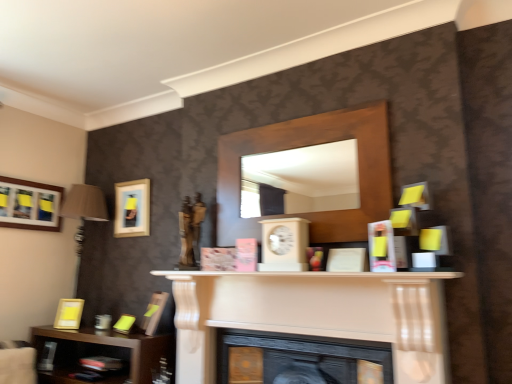
Question: Can you confirm if brown wooden shelf at lower left, which is counted as the 2th shelf, starting from the right, is shorter than matte black picture frame at upper left, the 2th picture frame positioned from the right?

Choices:
 (A) no
 (B) yes

Answer: (A)

Question: From the image's perspective, is brown wooden shelf at lower left, which ranks as the second shelf in top-to-bottom order, below matte black picture frame at upper left, the 2th picture frame positioned from the right?

Choices:
 (A) no
 (B) yes

Answer: (B)

Question: Is brown wooden shelf at lower left, which is counted as the 2th shelf, starting from the right, oriented away from matte black picture frame at upper left, which is the third picture frame in left-to-right order?

Choices:
 (A) no
 (B) yes

Answer: (A)

Question: Considering the relative sizes of brown wooden shelf at lower left, which is counted as the 2th shelf, starting from the right, and matte black picture frame at upper left, which is the third picture frame in left-to-right order, in the image provided, is brown wooden shelf at lower left, which is counted as the 2th shelf, starting from the right, wider than matte black picture frame at upper left, which is the third picture frame in left-to-right order,?

Choices:
 (A) yes
 (B) no

Answer: (A)

Question: Considering the relative sizes of brown wooden shelf at lower left, marked as the first shelf in a bottom-to-top arrangement, and matte black picture frame at upper left, which is the third picture frame in left-to-right order, in the image provided, is brown wooden shelf at lower left, marked as the first shelf in a bottom-to-top arrangement, thinner than matte black picture frame at upper left, which is the third picture frame in left-to-right order,?

Choices:
 (A) no
 (B) yes

Answer: (A)

Question: Considering the relative positions of brown wooden shelf at lower left, marked as the first shelf in a bottom-to-top arrangement, and matte black picture frame at upper left, which is the third picture frame in left-to-right order, in the image provided, is brown wooden shelf at lower left, marked as the first shelf in a bottom-to-top arrangement, to the left of matte black picture frame at upper left, which is the third picture frame in left-to-right order, from the viewer's perspective?

Choices:
 (A) yes
 (B) no

Answer: (A)

Question: Considering the relative positions of matte gold picture frame at lower left, the 4th picture frame when ordered from left to right, and black matte fireplace at center, which appears as the first fireplace when ordered from the bottom, in the image provided, is matte gold picture frame at lower left, the 4th picture frame when ordered from left to right, to the left of black matte fireplace at center, which appears as the first fireplace when ordered from the bottom, from the viewer's perspective?

Choices:
 (A) no
 (B) yes

Answer: (B)

Question: Considering the relative sizes of matte gold picture frame at lower left, the 4th picture frame when ordered from left to right, and black matte fireplace at center, acting as the 2th fireplace starting from the top, in the image provided, is matte gold picture frame at lower left, the 4th picture frame when ordered from left to right, bigger than black matte fireplace at center, acting as the 2th fireplace starting from the top,?

Choices:
 (A) yes
 (B) no

Answer: (B)

Question: Does matte gold picture frame at lower left, the 4th picture frame when ordered from left to right, have a smaller size compared to black matte fireplace at center, acting as the 2th fireplace starting from the top?

Choices:
 (A) no
 (B) yes

Answer: (B)

Question: Is matte gold picture frame at lower left, arranged as the 1th picture frame when viewed from the right, wider than black matte fireplace at center, acting as the 2th fireplace starting from the top?

Choices:
 (A) no
 (B) yes

Answer: (A)

Question: Is matte gold picture frame at lower left, the 4th picture frame when ordered from left to right, far away from black matte fireplace at center, acting as the 2th fireplace starting from the top?

Choices:
 (A) no
 (B) yes

Answer: (A)

Question: From the image's perspective, is matte gold picture frame at lower left, the 4th picture frame when ordered from left to right, over black matte fireplace at center, acting as the 2th fireplace starting from the top?

Choices:
 (A) no
 (B) yes

Answer: (B)

Question: From the image's perspective, is white matte fireplace at center, placed as the second fireplace when sorted from bottom to top, on top of wooden mirror at center, placed as the second shelf when sorted from bottom to top?

Choices:
 (A) yes
 (B) no

Answer: (B)